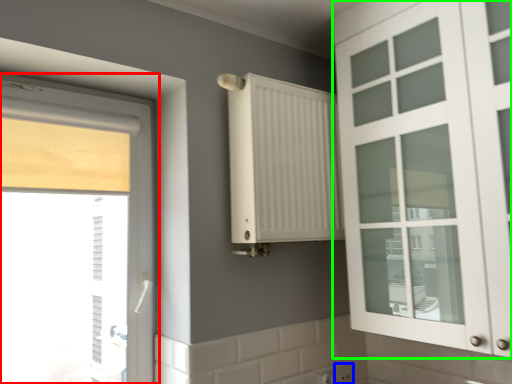
Question: Based on their relative distances, which object is nearer to window (highlighted by a red box)? Choose from electric outlet (highlighted by a blue box) and cabinetry (highlighted by a green box).

Choices:
 (A) electric outlet
 (B) cabinetry

Answer: (A)